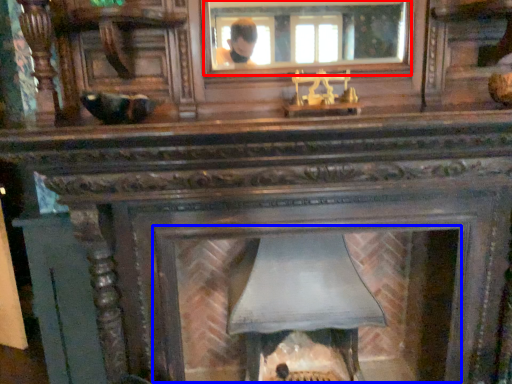
Question: Which object appears closest to the camera in this image, mirror (highlighted by a red box) or fireplace (highlighted by a blue box)?

Choices:
 (A) mirror
 (B) fireplace

Answer: (A)